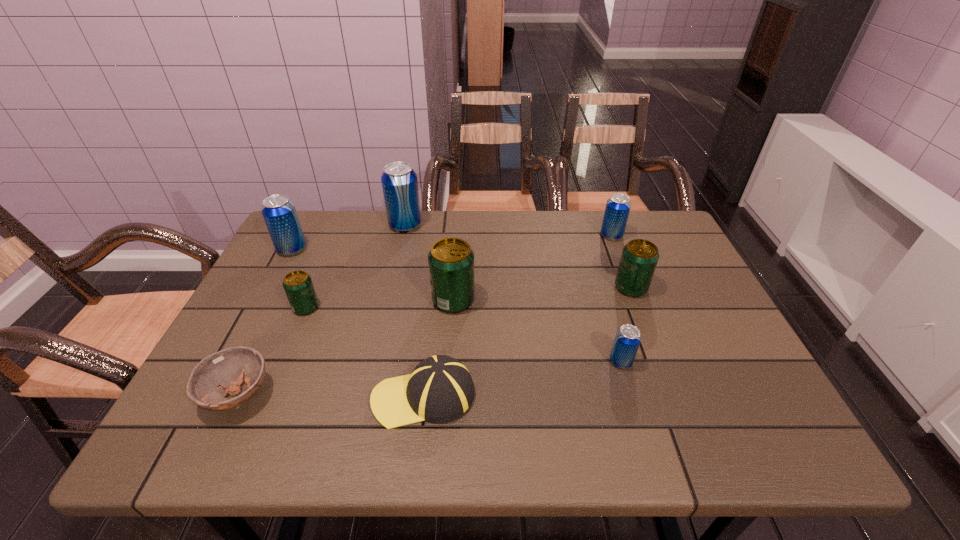
You are a GUI agent. You are given a task and a screenshot of the screen. Output one action in this format:
    pyautogui.click(x=<x>, y=<y>)
    Task: Click on the tallest beer can
    The image size is (960, 540).
    Given the screenshot: What is the action you would take?
    pyautogui.click(x=399, y=182)

Find the location of a particular element. Image resolution: width=960 pixels, height=540 pixels. the third beer can from left to right is located at coordinates (399, 182).

Locate an element on the screen. The height and width of the screenshot is (540, 960). the leftmost beer can is located at coordinates click(279, 212).

Where is `the third smallest blue beer can`? The image size is (960, 540). the third smallest blue beer can is located at coordinates (279, 212).

Where is `the biggest green beer can`? the biggest green beer can is located at coordinates (451, 260).

Identify the location of the fourth beer can from left to right. (451, 260).

Image resolution: width=960 pixels, height=540 pixels. Identify the location of the second smallest blue beer can. (617, 209).

I want to click on the second biggest green beer can, so click(639, 258).

I want to click on the smallest blue beer can, so click(627, 339).

Locate an element on the screen. The image size is (960, 540). the second blue beer can from right to left is located at coordinates (627, 339).